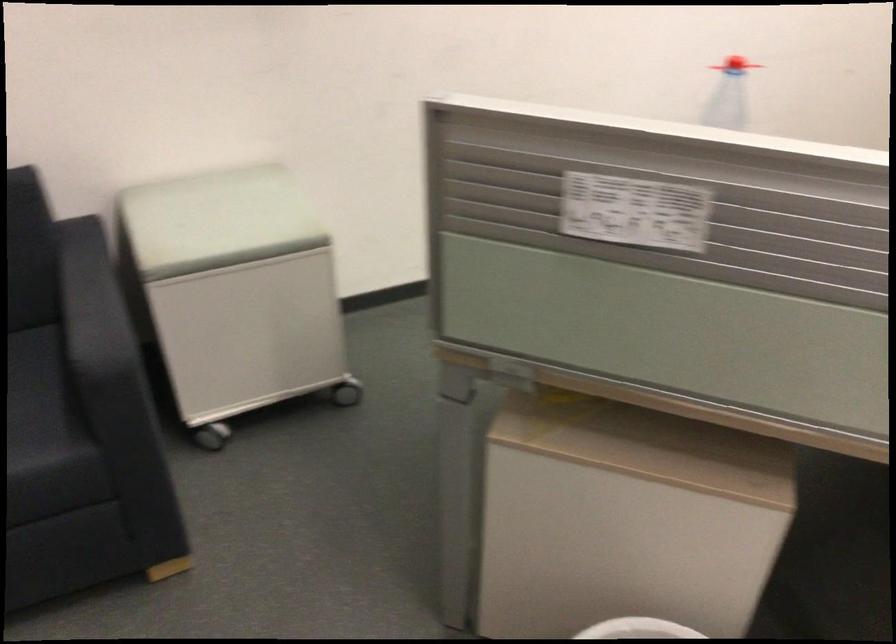
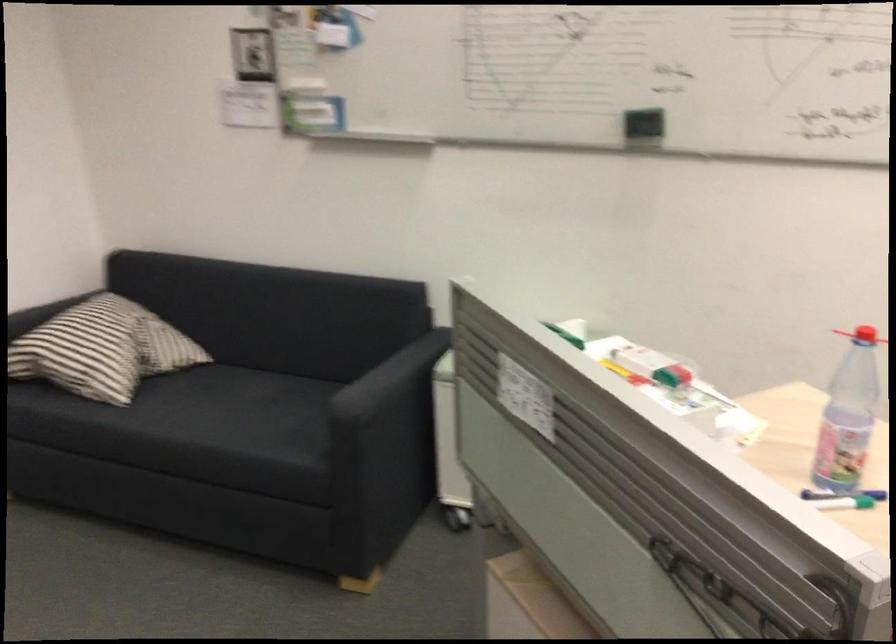
Question: The camera is either moving clockwise (left) or counter-clockwise (right) around the object. The first image is from the beginning of the video and the second image is from the end. Is the camera moving left or right when shooting the video?

Choices:
 (A) Left
 (B) Right

Answer: (B)